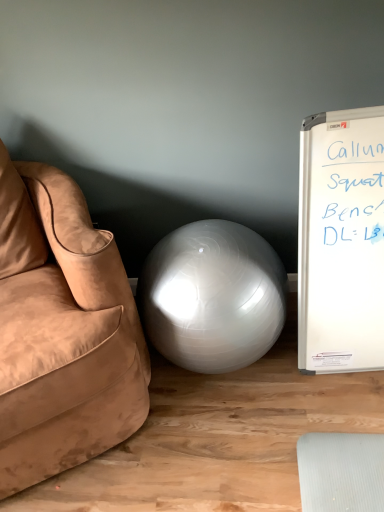
Question: Relative to satin white ball at center, is suede brown couch at left in front or behind?

Choices:
 (A) front
 (B) behind

Answer: (A)

Question: From a real-world perspective, is suede brown couch at left positioned above or below satin white ball at center?

Choices:
 (A) above
 (B) below

Answer: (A)

Question: Considering the relative positions of suede brown couch at left and satin white ball at center in the image provided, is suede brown couch at left to the left or to the right of satin white ball at center?

Choices:
 (A) left
 (B) right

Answer: (A)

Question: From a real-world perspective, relative to suede brown couch at left, is satin white ball at center vertically above or below?

Choices:
 (A) below
 (B) above

Answer: (A)

Question: Is point [218, 322] closer or farther from the camera than point [82, 260]?

Choices:
 (A) farther
 (B) closer

Answer: (A)

Question: Do you think satin white ball at center is within suede brown couch at left, or outside of it?

Choices:
 (A) outside
 (B) inside

Answer: (A)

Question: Would you say satin white ball at center is to the left or to the right of suede brown couch at left in the picture?

Choices:
 (A) left
 (B) right

Answer: (B)